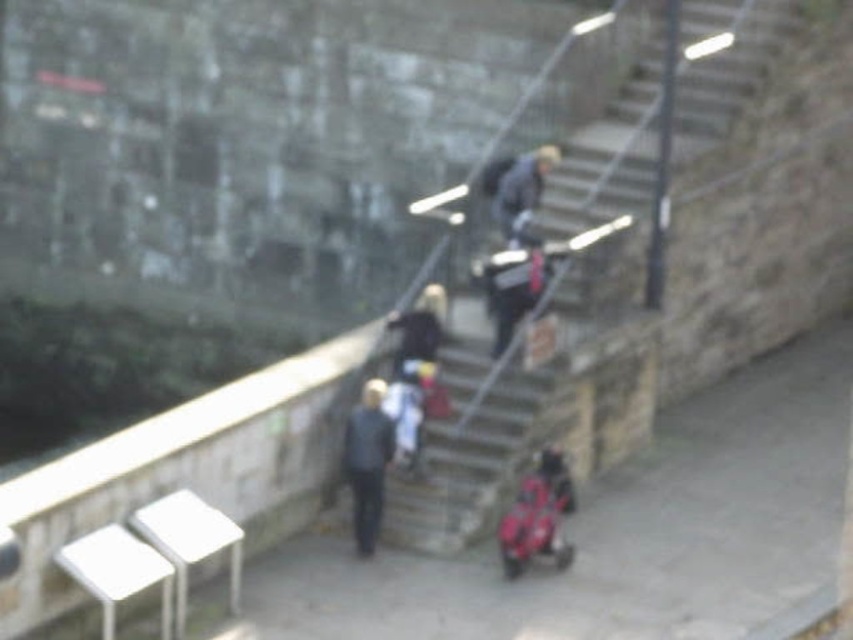
You are a delivery person needing to reach the person with the dark blue jacket at upper center. You are currently standing next to the dark blue jacket at center. Given that your delivery cart is 2.5 feet wide, can you navigate the staircase between the two dark blue jackets?

The distance between dark blue jacket at center and dark blue jacket at upper center is 6.79 feet. Since the delivery cart is 2.5 feet wide, the cart can easily navigate the staircase as the distance is sufficient for movement.